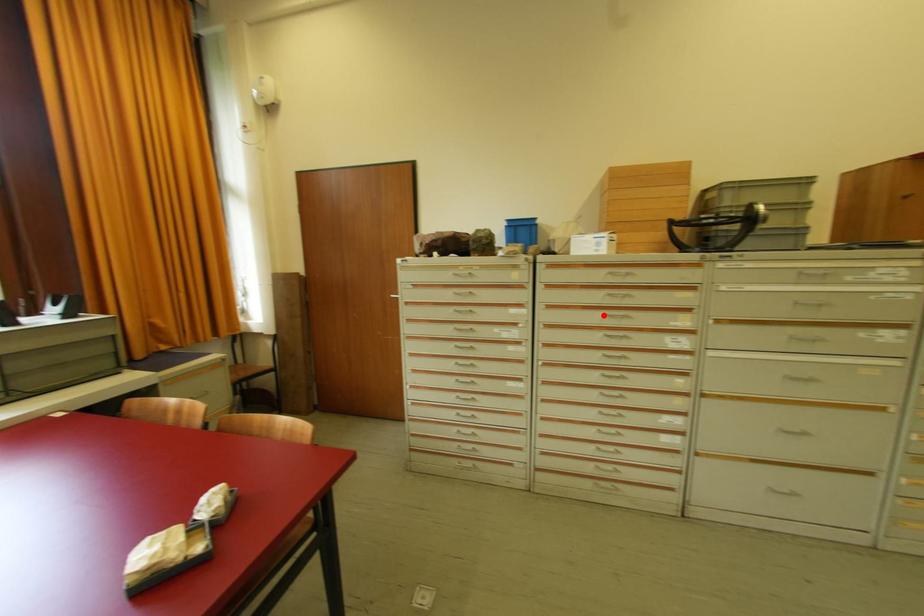
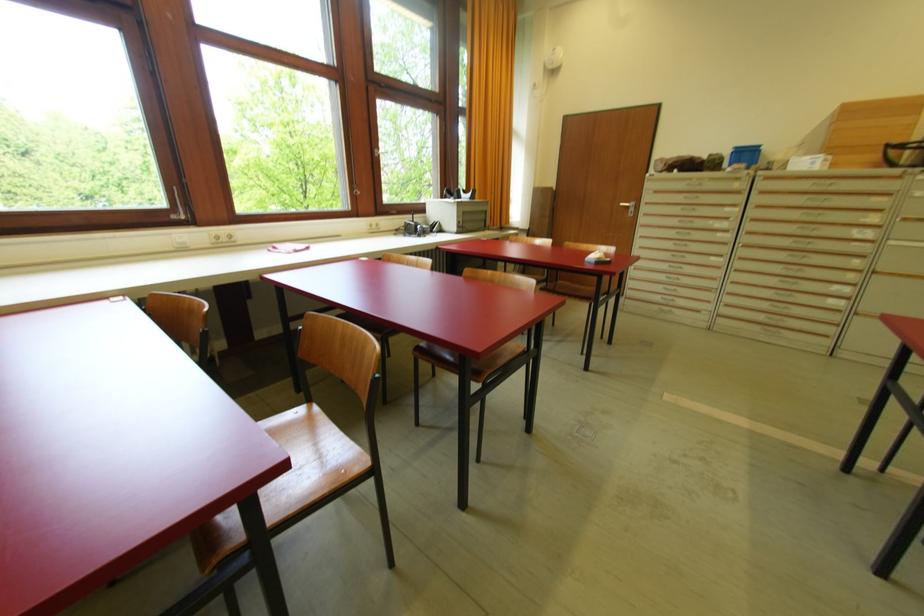
Question: I am providing you with two images of the same scene from different viewpoints. Image1 has a red point marked. In image2, the corresponding 3D location appears at what relative position? Reply with the corresponding letter.

Choices:
 (A) Closer
 (B) Farther

Answer: (B)